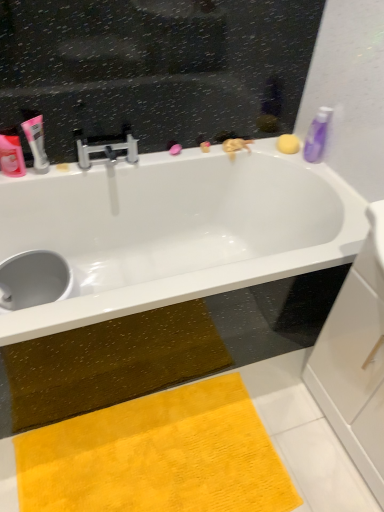
Find the location of a particular element. The height and width of the screenshot is (512, 384). free point above yellow plush doormat at lower center (from a real-world perspective) is located at coordinates (161, 458).